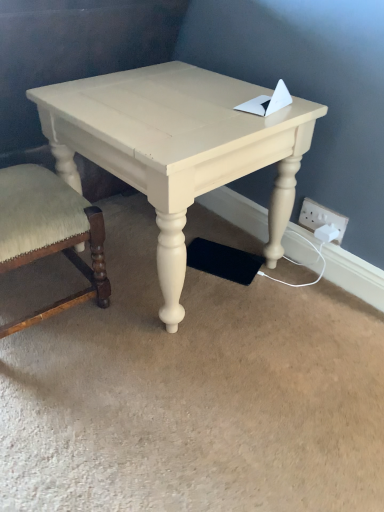
The height and width of the screenshot is (512, 384). In order to click on empty space that is ontop of velvet beige chair at lower left (from a real-world perspective) in this screenshot , I will do `click(28, 190)`.